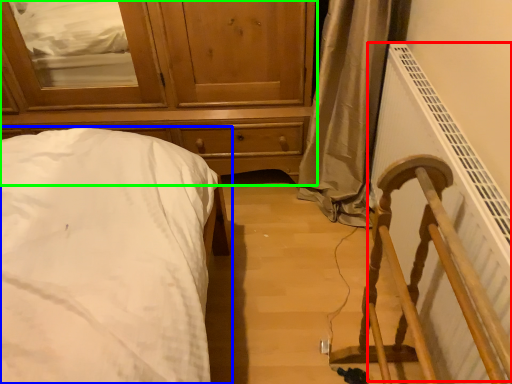
Question: Considering the real-world distances, which object is closest to radiator (highlighted by a red box)? bed (highlighted by a blue box) or chest of drawers (highlighted by a green box).

Choices:
 (A) bed
 (B) chest of drawers

Answer: (B)